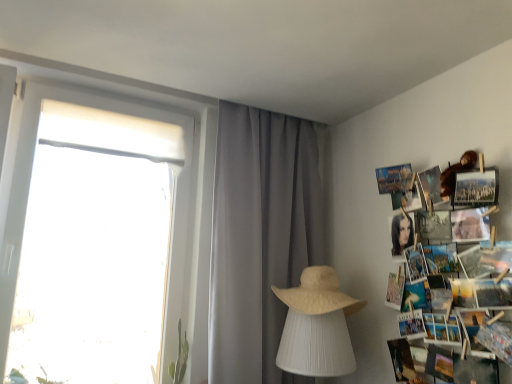
Question: Does printed paper collage at right have a greater width compared to beige straw hat at center?

Choices:
 (A) no
 (B) yes

Answer: (A)

Question: Can you confirm if printed paper collage at right is positioned to the left of beige straw hat at center?

Choices:
 (A) yes
 (B) no

Answer: (B)

Question: Is printed paper collage at right positioned in front of beige straw hat at center?

Choices:
 (A) no
 (B) yes

Answer: (B)

Question: Does printed paper collage at right have a smaller size compared to beige straw hat at center?

Choices:
 (A) no
 (B) yes

Answer: (A)

Question: Is printed paper collage at right in contact with beige straw hat at center?

Choices:
 (A) no
 (B) yes

Answer: (A)

Question: From their relative heights in the image, would you say beige straw hat at center is taller or shorter than printed paper collage at right?

Choices:
 (A) tall
 (B) short

Answer: (B)

Question: Would you say beige straw hat at center is to the left or to the right of printed paper collage at right in the picture?

Choices:
 (A) left
 (B) right

Answer: (A)

Question: Is beige straw hat at center spatially inside printed paper collage at right, or outside of it?

Choices:
 (A) inside
 (B) outside

Answer: (B)

Question: From the image's perspective, is beige straw hat at center located above or below printed paper collage at right?

Choices:
 (A) below
 (B) above

Answer: (A)

Question: In terms of width, does gray sheer curtain at center look wider or thinner when compared to beige straw hat at center?

Choices:
 (A) thin
 (B) wide

Answer: (A)

Question: Considering their positions, is gray sheer curtain at center located in front of or behind beige straw hat at center?

Choices:
 (A) front
 (B) behind

Answer: (B)

Question: Choose the correct answer: Is gray sheer curtain at center inside beige straw hat at center or outside it?

Choices:
 (A) outside
 (B) inside

Answer: (A)

Question: In terms of height, does gray sheer curtain at center look taller or shorter compared to beige straw hat at center?

Choices:
 (A) short
 (B) tall

Answer: (B)

Question: Considering the positions of printed paper collage at right and beige straw hat at center in the image, is printed paper collage at right wider or thinner than beige straw hat at center?

Choices:
 (A) thin
 (B) wide

Answer: (A)

Question: From their relative heights in the image, would you say printed paper collage at right is taller or shorter than beige straw hat at center?

Choices:
 (A) tall
 (B) short

Answer: (A)